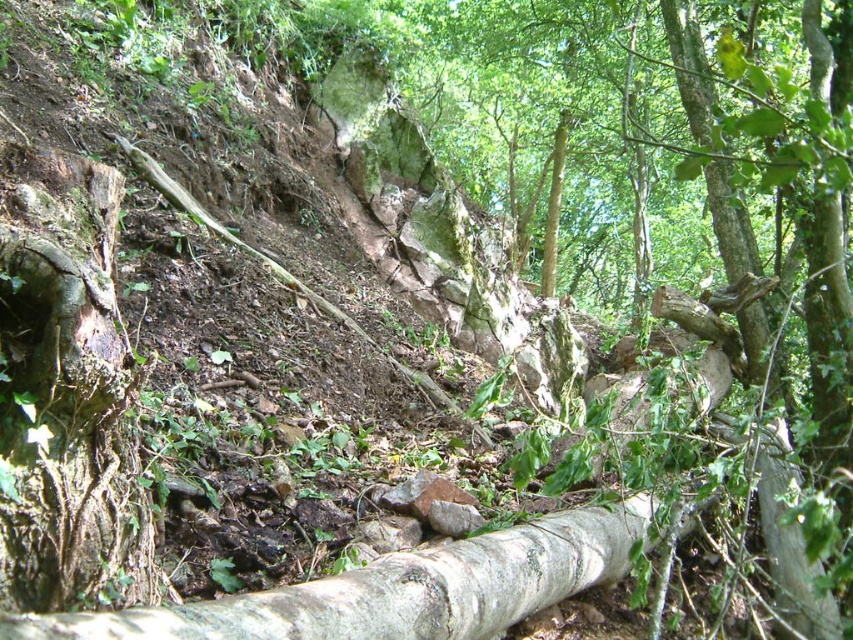
Which is in front, point (74, 518) or point (61, 636)?

Point (61, 636) is in front.

Is brown rough tree trunk at left to the left of white rough bark log at lower center from the viewer's perspective?

Correct, you'll find brown rough tree trunk at left to the left of white rough bark log at lower center.

Does point (21, 442) come closer to viewer compared to point (306, 621)?

No, it is not.

The height and width of the screenshot is (640, 853). I want to click on brown rough tree trunk at left, so click(67, 396).